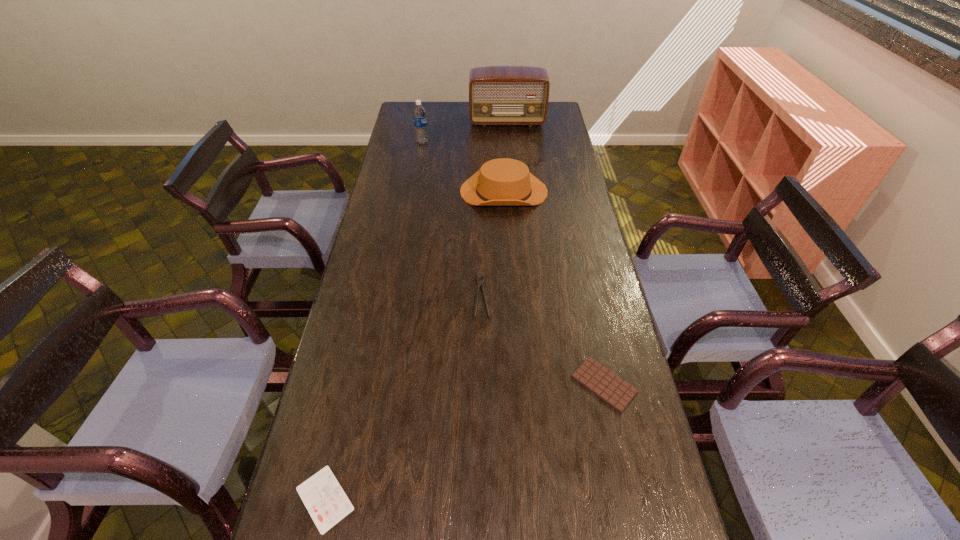
Locate an element on the screen. This screenshot has height=540, width=960. the farthest object is located at coordinates (498, 95).

I want to click on radio receiver, so click(x=498, y=95).

The height and width of the screenshot is (540, 960). Identify the location of water bottle. (419, 114).

I want to click on the fifth shortest object, so click(419, 114).

This screenshot has height=540, width=960. Identify the location of the fourth shortest object. 503,181.

I want to click on the third farthest object, so click(x=503, y=181).

The image size is (960, 540). Identify the location of tongs. (480, 283).

Image resolution: width=960 pixels, height=540 pixels. I want to click on the third shortest object, so click(x=480, y=283).

The image size is (960, 540). I want to click on the second shortest object, so click(609, 387).

At what (x,y) coordinates should I click in order to perform the action: click on chocolate bar. Please return your answer as a coordinate pair (x, y). The height and width of the screenshot is (540, 960). Looking at the image, I should click on (609, 387).